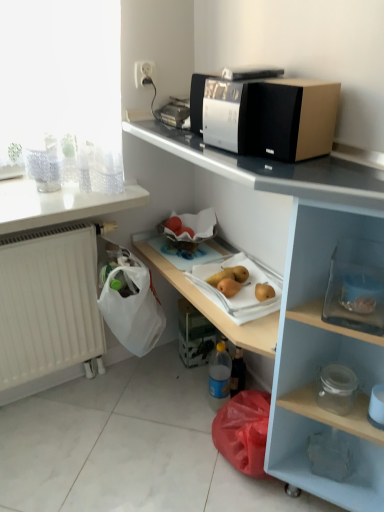
At what (x,y) coordinates should I click in order to perform the action: click on free spot to the left of white glossy countertop at upper center, which is counted as the second countertop, starting from the left. Please return your answer as a coordinate pair (x, y). The image size is (384, 512). Looking at the image, I should click on (119, 448).